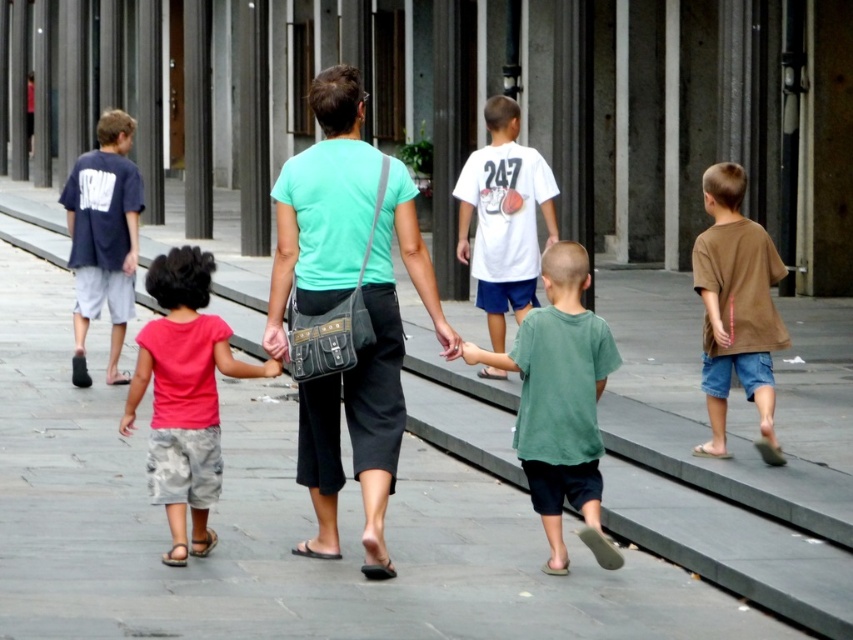
Can you confirm if gray concrete pavement at center is positioned below matte green shirt at center?

Yes, gray concrete pavement at center is below matte green shirt at center.

Measure the distance from gray concrete pavement at center to matte green shirt at center.

gray concrete pavement at center and matte green shirt at center are 2.28 meters apart from each other.

Which is behind, point (442, 493) or point (316, 385)?

Positioned behind is point (442, 493).

Locate an element on the screen. The height and width of the screenshot is (640, 853). gray concrete pavement at center is located at coordinates (345, 524).

Where is `matte green shirt at center`? This screenshot has height=640, width=853. matte green shirt at center is located at coordinates (368, 388).

Is point (360, 147) positioned after point (532, 438)?

That is False.

Image resolution: width=853 pixels, height=640 pixels. Describe the element at coordinates (368, 388) in the screenshot. I see `matte green shirt at center` at that location.

Find the location of a particular element. matte green shirt at center is located at coordinates (368, 388).

Is matte green shirt at center to the right of brown cotton shirt at right from the viewer's perspective?

No, matte green shirt at center is not to the right of brown cotton shirt at right.

Which is in front, point (297, 173) or point (729, 257)?

Point (297, 173)

Find the location of a particular element. matte green shirt at center is located at coordinates (368, 388).